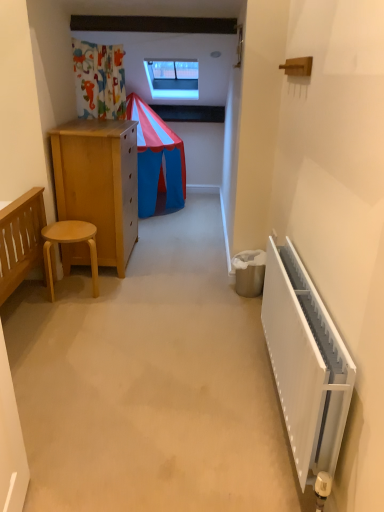
Where is `vacant space situated above light wood stool at left (from a real-world perspective)`? This screenshot has height=512, width=384. vacant space situated above light wood stool at left (from a real-world perspective) is located at coordinates click(x=69, y=231).